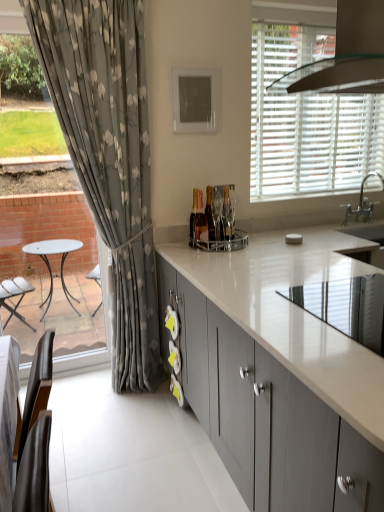
Question: Considering the relative sizes of clear glass exhaust hood at upper right and white glossy sink at upper right in the image provided, is clear glass exhaust hood at upper right taller than white glossy sink at upper right?

Choices:
 (A) no
 (B) yes

Answer: (B)

Question: Does clear glass exhaust hood at upper right have a lesser width compared to white glossy sink at upper right?

Choices:
 (A) no
 (B) yes

Answer: (A)

Question: From a real-world perspective, is clear glass exhaust hood at upper right positioned under white glossy sink at upper right based on gravity?

Choices:
 (A) no
 (B) yes

Answer: (A)

Question: From the image's perspective, does clear glass exhaust hood at upper right appear higher than white glossy sink at upper right?

Choices:
 (A) no
 (B) yes

Answer: (B)

Question: Can you confirm if clear glass exhaust hood at upper right is wider than white glossy sink at upper right?

Choices:
 (A) no
 (B) yes

Answer: (B)

Question: Is matte gray cabinets at center to the left or to the right of white glossy countertop at center in the image?

Choices:
 (A) right
 (B) left

Answer: (B)

Question: Which is correct: matte gray cabinets at center is inside white glossy countertop at center, or outside of it?

Choices:
 (A) inside
 (B) outside

Answer: (B)

Question: Considering the positions of matte gray cabinets at center and white glossy countertop at center in the image, is matte gray cabinets at center taller or shorter than white glossy countertop at center?

Choices:
 (A) short
 (B) tall

Answer: (B)

Question: Does point (187, 387) appear closer or farther from the camera than point (365, 325)?

Choices:
 (A) closer
 (B) farther

Answer: (B)

Question: From a real-world perspective, relative to fluffy gray curtain at left, is matte gray cabinets at center vertically above or below?

Choices:
 (A) above
 (B) below

Answer: (B)

Question: Is matte gray cabinets at center wider or thinner than fluffy gray curtain at left?

Choices:
 (A) thin
 (B) wide

Answer: (B)

Question: Visually, is matte gray cabinets at center positioned to the left or to the right of fluffy gray curtain at left?

Choices:
 (A) left
 (B) right

Answer: (B)

Question: Considering the positions of point (248, 271) and point (104, 64), is point (248, 271) closer or farther from the camera than point (104, 64)?

Choices:
 (A) farther
 (B) closer

Answer: (B)

Question: From the image's perspective, is white matte blinds at upper right positioned above or below matte gray cabinets at center?

Choices:
 (A) above
 (B) below

Answer: (A)

Question: In terms of height, does white matte blinds at upper right look taller or shorter compared to matte gray cabinets at center?

Choices:
 (A) tall
 (B) short

Answer: (A)